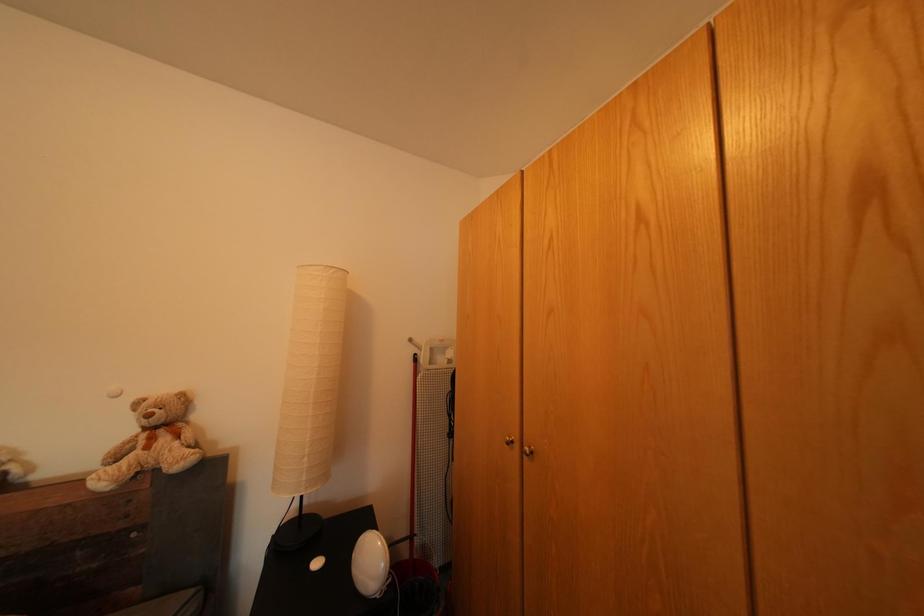
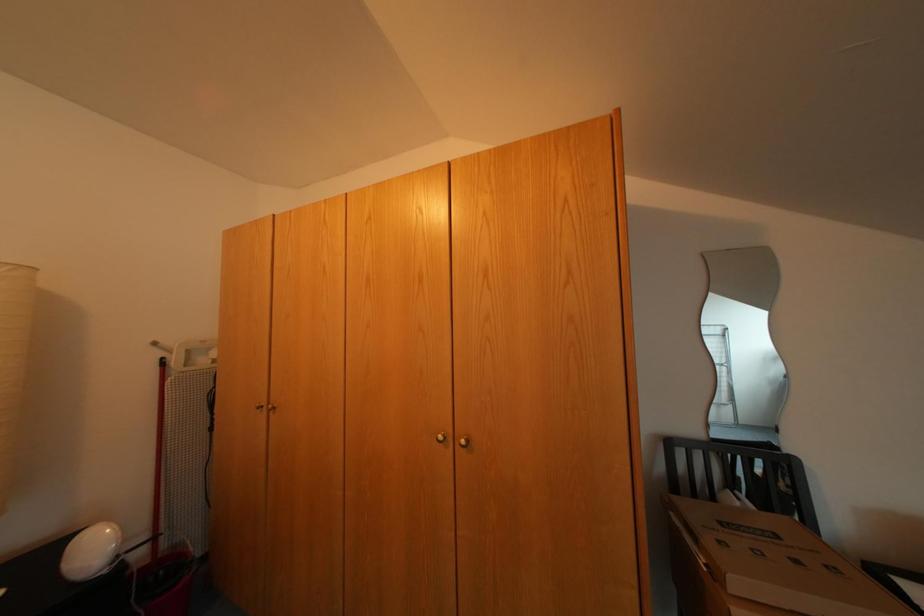
Question: Based on the continuous images, in which direction is the camera rotating? Reply with the corresponding letter.

Choices:
 (A) Left
 (B) Right
 (C) Up
 (D) Down

Answer: (B)